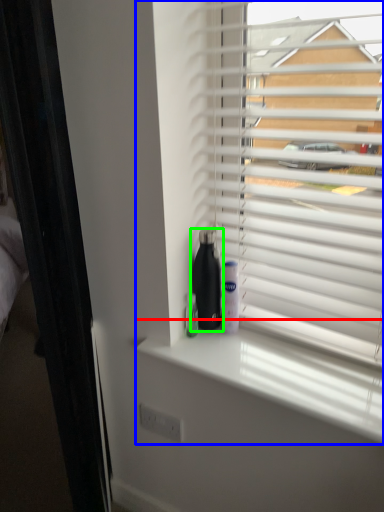
Question: Which object is the farthest from window sill (highlighted by a red box)? Choose among these: window blind (highlighted by a blue box) or bottle (highlighted by a green box).

Choices:
 (A) window blind
 (B) bottle

Answer: (A)